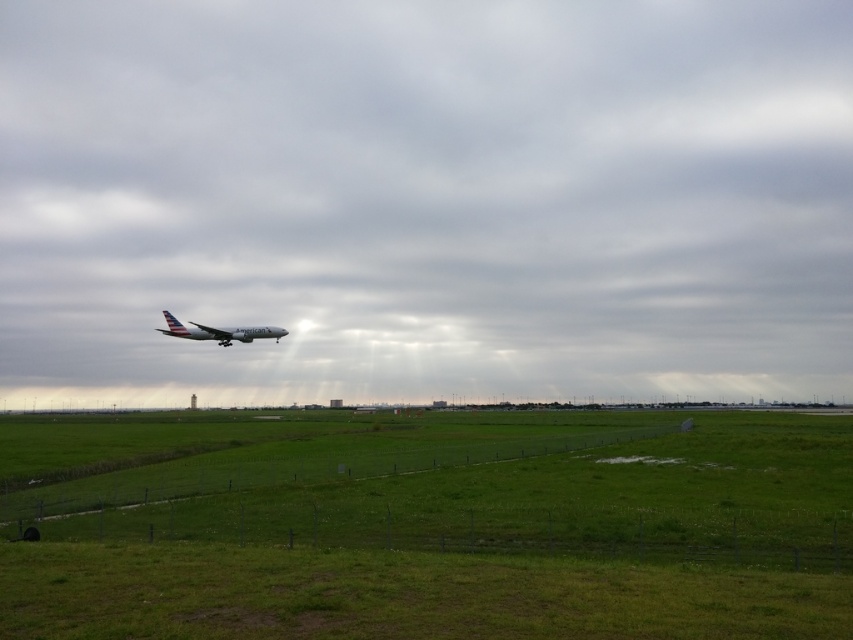
Question: Based on their relative distances, which object is farther from the green grass at lower center?

Choices:
 (A) transparent glass airplane at center
 (B) silver metallic airplane at center

Answer: (A)

Question: Is transparent glass airplane at center positioned behind silver metallic airplane at center?

Choices:
 (A) no
 (B) yes

Answer: (A)

Question: Which of the following is the closest to the observer?

Choices:
 (A) green grass at lower center
 (B) transparent glass airplane at center
 (C) silver metallic airplane at center

Answer: (A)

Question: Which of these objects is positioned closest to the transparent glass airplane at center?

Choices:
 (A) silver metallic airplane at center
 (B) green grass at lower center

Answer: (B)

Question: Can you confirm if green grass at lower center is wider than silver metallic airplane at center?

Choices:
 (A) no
 (B) yes

Answer: (B)

Question: Is green grass at lower center above silver metallic airplane at center?

Choices:
 (A) no
 (B) yes

Answer: (A)